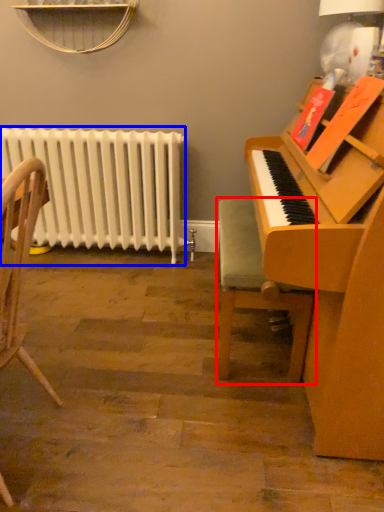
Question: Among these objects, which one is nearest to the camera, chair (highlighted by a red box) or radiator (highlighted by a blue box)?

Choices:
 (A) chair
 (B) radiator

Answer: (A)